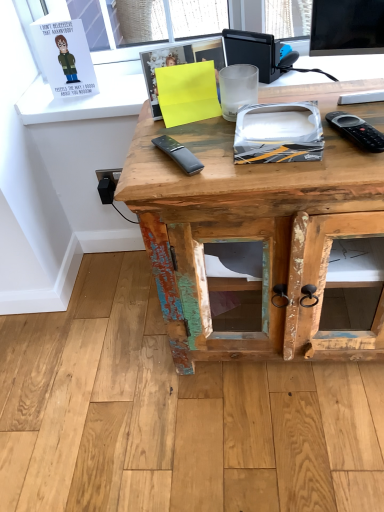
Identify the location of vacant area that is in front of matte paper card at upper left, positioned as the 1th book in back-to-front order. The image size is (384, 512). (83, 106).